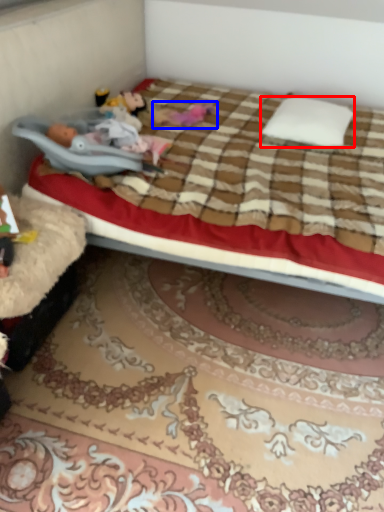
Question: Which of the following is the farthest to the observer, pillow (highlighted by a red box) or toy (highlighted by a blue box)?

Choices:
 (A) pillow
 (B) toy

Answer: (B)